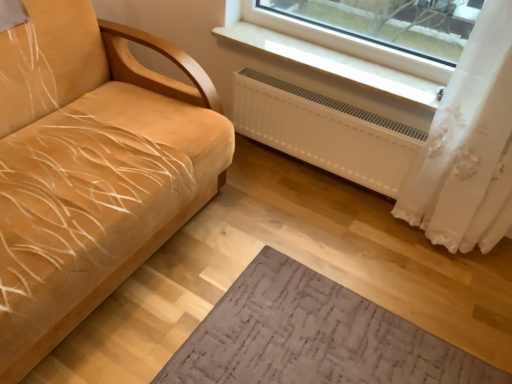
You are a GUI agent. You are given a task and a screenshot of the screen. Output one action in this format:
    pyautogui.click(x=<x>, y=<y>)
    Task: Click on the free location to the left of white sheer curtain at right
    This screenshot has width=512, height=384.
    Given the screenshot: What is the action you would take?
    pyautogui.click(x=354, y=236)